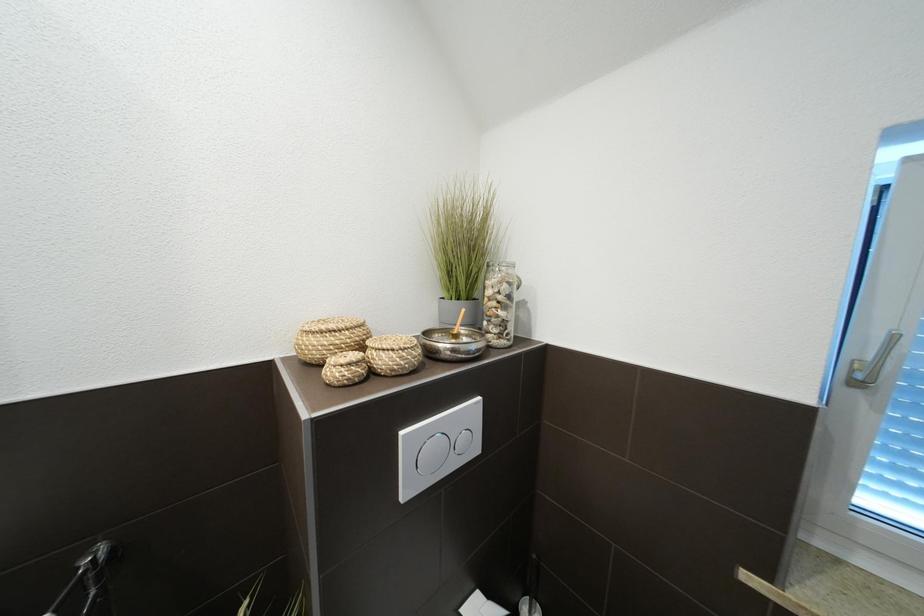
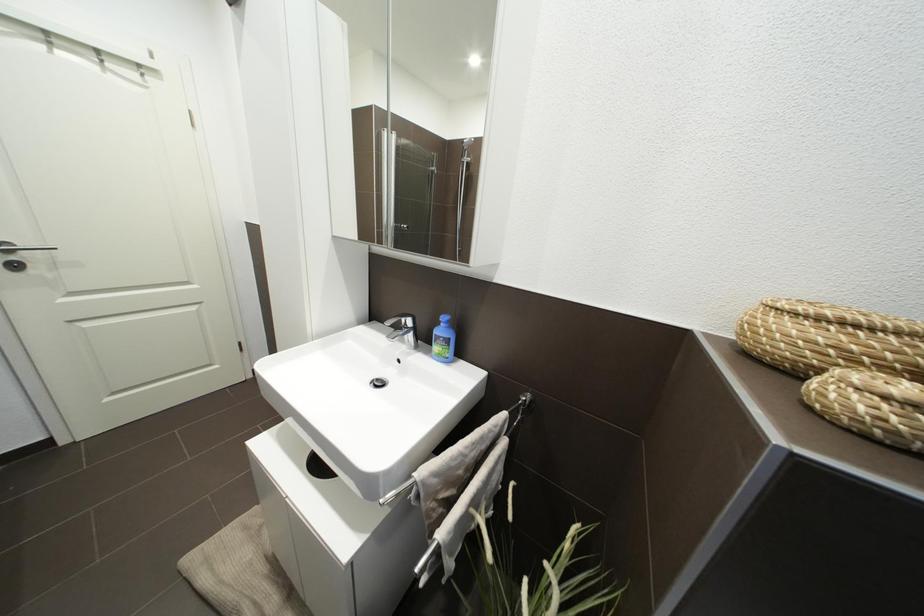
First-person continuous shooting, in which direction is the camera rotating?

The camera's rotation is toward left-down.